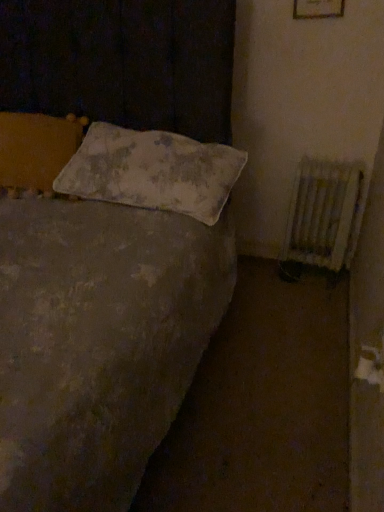
Question: Is point (177, 202) positioned closer to the camera than point (299, 204)?

Choices:
 (A) farther
 (B) closer

Answer: (B)

Question: In terms of size, does white fabric pillow at center appear bigger or smaller than white painted metal radiator at right?

Choices:
 (A) small
 (B) big

Answer: (B)

Question: Considering the positions of white fabric pillow at center and white painted metal radiator at right in the image, is white fabric pillow at center taller or shorter than white painted metal radiator at right?

Choices:
 (A) tall
 (B) short

Answer: (B)

Question: From a real-world perspective, is white painted metal radiator at right above or below white fabric pillow at center?

Choices:
 (A) below
 (B) above

Answer: (A)

Question: In terms of width, does white painted metal radiator at right look wider or thinner when compared to white fabric pillow at center?

Choices:
 (A) thin
 (B) wide

Answer: (A)

Question: Considering the positions of white painted metal radiator at right and white fabric pillow at center in the image, is white painted metal radiator at right taller or shorter than white fabric pillow at center?

Choices:
 (A) short
 (B) tall

Answer: (B)

Question: Relative to white fabric pillow at center, is white painted metal radiator at right in front or behind?

Choices:
 (A) front
 (B) behind

Answer: (B)